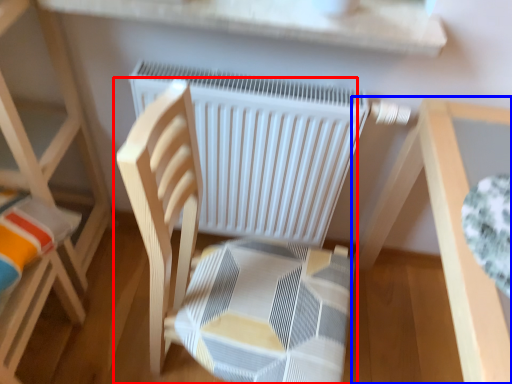
Question: Which point is closer to the camera, chair (highlighted by a red box) or table (highlighted by a blue box)?

Choices:
 (A) chair
 (B) table

Answer: (A)